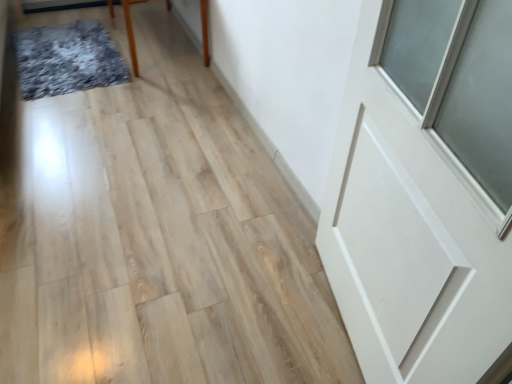
Question: From the image's perspective, is white matte door at upper right located above or below textured gray mat at upper left?

Choices:
 (A) below
 (B) above

Answer: (A)

Question: Based on their sizes in the image, would you say white matte door at upper right is bigger or smaller than textured gray mat at upper left?

Choices:
 (A) big
 (B) small

Answer: (A)

Question: Which is farther from the white matte door at upper right?

Choices:
 (A) brown wooden table at upper left
 (B) textured gray mat at upper left

Answer: (B)

Question: Estimate the real-world distances between objects in this image. Which object is farther from the white matte door at upper right?

Choices:
 (A) textured gray mat at upper left
 (B) brown wooden table at upper left

Answer: (A)